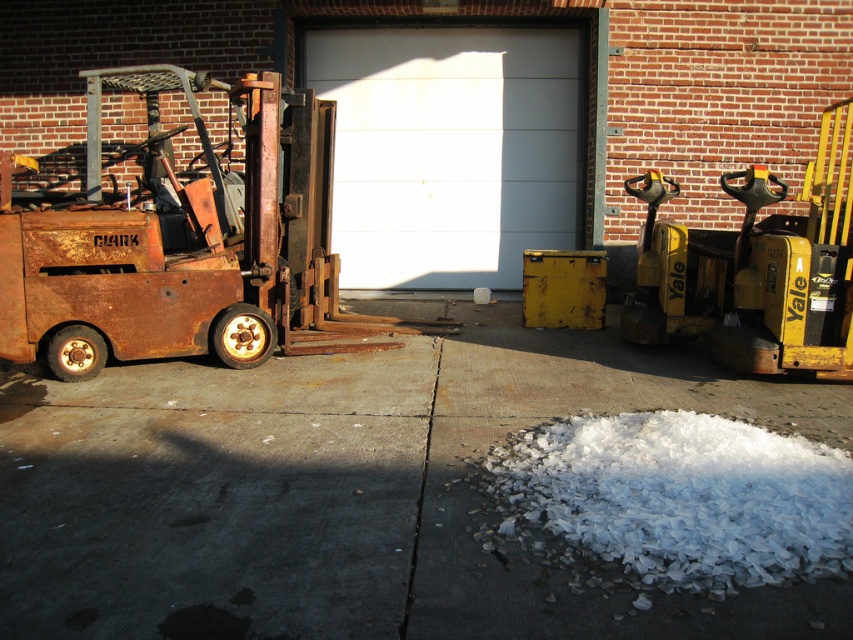
You are a delivery driver who needs to park your truck between the concrete pavement at center and the rusty metal forklift at left. Can you fit your truck there if your truck is 2 meters long?

The concrete pavement at center is shorter than the rusty metal forklift at left. Since the truck is 2 meters long, but the available space between them is not specified, it is unclear if the truck can fit. Please check the exact dimensions of the space.

You are a delivery driver who needs to park your truck between the concrete pavement at center and the rusty metal forklift at left. Based on the scene description, can you safely park your truck there?

The concrete pavement at center is to the right of the rusty metal forklift at left, so there is space between them. Since the truck can be parked in the available space between the two objects, it is safe to park there.

You are standing in front of the warehouse and want to move from point (3, 492) to point (833, 499). Which direction should you move relative to the warehouse?

You should move away from the warehouse because point (3, 492) is closer to the camera than point (833, 499), so moving towards it would mean moving away from the warehouse.